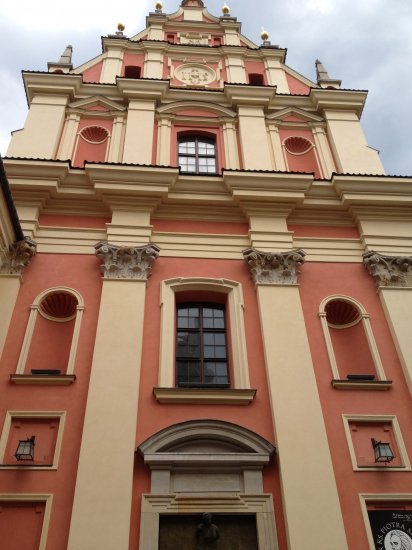
This screenshot has height=550, width=412. What are the coordinates of `window` in the screenshot? It's located at click(209, 352), click(193, 152), click(204, 148), click(205, 162), click(188, 163), click(206, 315), click(195, 315), click(193, 349), click(193, 373), click(216, 371).